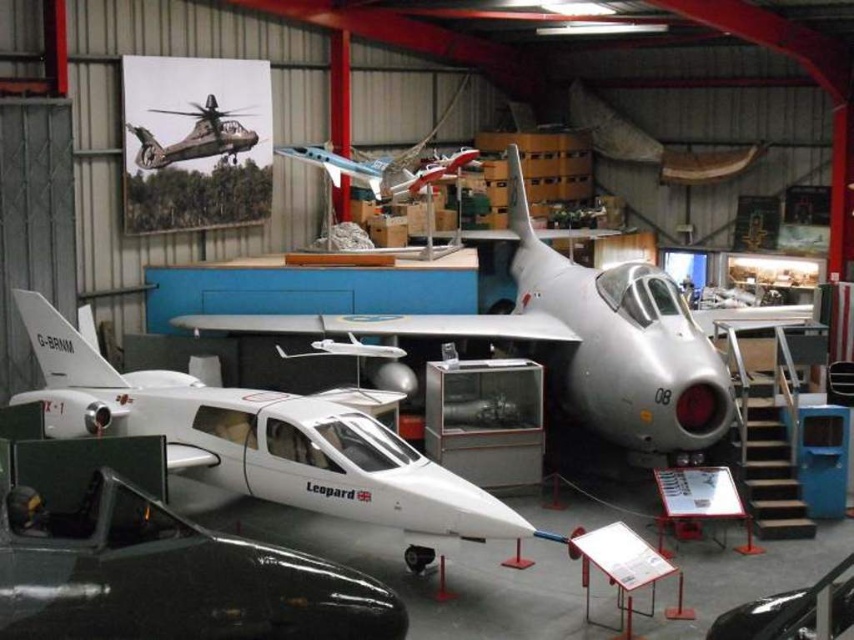
Can you confirm if metallic blue airplane at center is positioned to the left of camouflage fabric helicopter at upper left?

In fact, metallic blue airplane at center is to the right of camouflage fabric helicopter at upper left.

Does metallic blue airplane at center have a smaller size compared to camouflage fabric helicopter at upper left?

Correct, metallic blue airplane at center occupies less space than camouflage fabric helicopter at upper left.

Where is `metallic blue airplane at center`? metallic blue airplane at center is located at coordinates (389, 163).

Can you confirm if white matte airplane at center is taller than camouflage fabric helicopter at upper left?

Incorrect, white matte airplane at center's height is not larger of camouflage fabric helicopter at upper left's.

Can you confirm if white matte airplane at center is wider than camouflage fabric helicopter at upper left?

Yes, white matte airplane at center is wider than camouflage fabric helicopter at upper left.

This screenshot has height=640, width=854. What do you see at coordinates (259, 440) in the screenshot?
I see `white matte airplane at center` at bounding box center [259, 440].

Image resolution: width=854 pixels, height=640 pixels. Find the location of `white matte airplane at center`. white matte airplane at center is located at coordinates (259, 440).

Can you confirm if glossy white airplane at center is thinner than white matte airplane at center?

No, glossy white airplane at center is not thinner than white matte airplane at center.

Does glossy white airplane at center have a greater height compared to white matte airplane at center?

Indeed, glossy white airplane at center has a greater height compared to white matte airplane at center.

The image size is (854, 640). I want to click on glossy white airplane at center, so click(x=155, y=563).